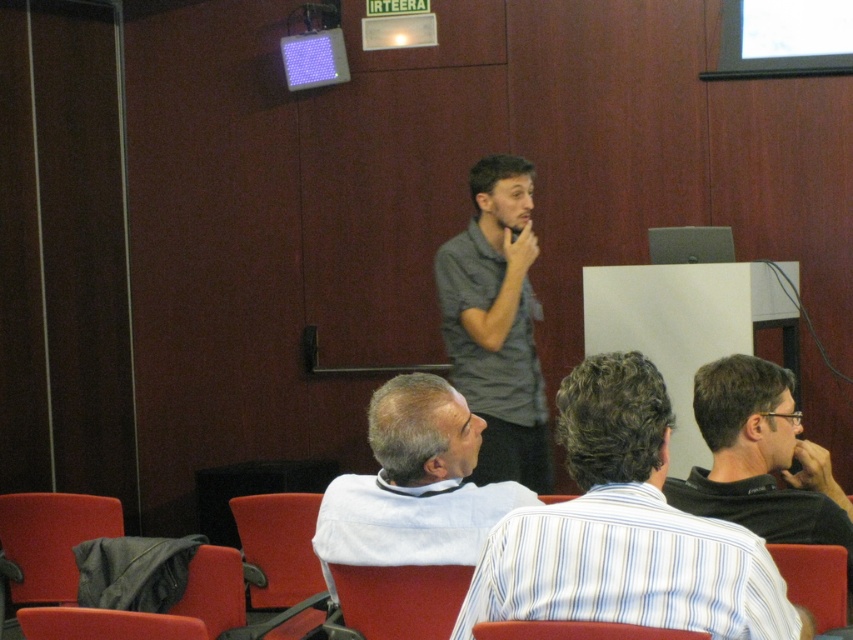
Question: Which object is closer to the camera taking this photo?

Choices:
 (A) red fabric chair at lower right
 (B) red fabric chair at lower left
 (C) red fabric chair at lower center

Answer: (C)

Question: Is white shirt at center closer to camera compared to red fabric chair at lower right?

Choices:
 (A) yes
 (B) no

Answer: (B)

Question: Which object appears farthest from the camera in this image?

Choices:
 (A) red fabric chair at lower center
 (B) matte red chair at lower left
 (C) red fabric chair at lower left
 (D) gray matte shirt at center

Answer: (D)

Question: Can you confirm if gray matte shirt at center is bigger than matte red chair at lower center?

Choices:
 (A) no
 (B) yes

Answer: (B)

Question: Based on their relative distances, which object is farther from the gray matte shirt at center?

Choices:
 (A) red fabric chair at lower left
 (B) black matte shirt at lower right
 (C) striped cotton shirt at center
 (D) white shirt at center

Answer: (C)

Question: Where is red fabric chair at lower right located in relation to red fabric chair at lower center in the image?

Choices:
 (A) left
 (B) right

Answer: (B)